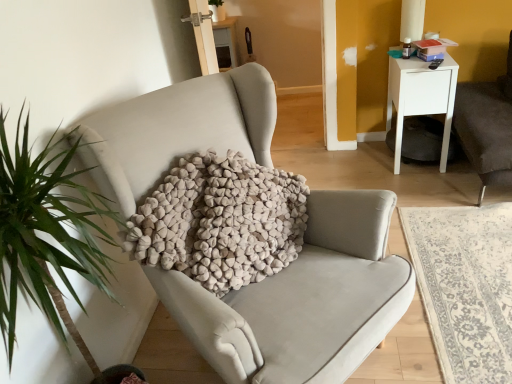
Find the location of a particular element. black plastic remote control at upper right is located at coordinates (435, 64).

Find the location of `white glossy nightstand at upper right`. white glossy nightstand at upper right is located at coordinates (421, 97).

The height and width of the screenshot is (384, 512). Describe the element at coordinates (303, 299) in the screenshot. I see `beige fabric chair at center` at that location.

This screenshot has height=384, width=512. Find the location of `black plastic remote control at upper right`. black plastic remote control at upper right is located at coordinates (435, 64).

From the image's perspective, which one is positioned higher, white glossy nightstand at upper right or beige fabric chair at center?

white glossy nightstand at upper right is shown above in the image.

Does white glossy nightstand at upper right appear on the left side of beige fabric chair at center?

In fact, white glossy nightstand at upper right is to the right of beige fabric chair at center.

Does white glossy nightstand at upper right contain beige fabric chair at center?

Definitely not — beige fabric chair at center is not inside white glossy nightstand at upper right.

From a real-world perspective, is black plastic remote control at upper right over beige fabric chair at center?

Correct, in the physical world, black plastic remote control at upper right is higher than beige fabric chair at center.

Is point (433, 64) more distant than point (116, 138)?

Yes, it is behind point (116, 138).

Is black plastic remote control at upper right surrounding beige fabric chair at center?

No, beige fabric chair at center is not a part of black plastic remote control at upper right.

Would you say black plastic remote control at upper right is a long distance from beige fabric chair at center?

That's right, there is a large distance between black plastic remote control at upper right and beige fabric chair at center.

Would you say white glossy nightstand at upper right is inside or outside black plastic remote control at upper right?

white glossy nightstand at upper right is outside black plastic remote control at upper right.

From the image's perspective, which is below, white glossy nightstand at upper right or black plastic remote control at upper right?

white glossy nightstand at upper right appears lower in the image.

Considering the relative sizes of white glossy nightstand at upper right and black plastic remote control at upper right in the image provided, is white glossy nightstand at upper right taller than black plastic remote control at upper right?

Indeed, white glossy nightstand at upper right has a greater height compared to black plastic remote control at upper right.

Between point (429, 69) and point (435, 62), which one is positioned behind?

The point (435, 62) is farther from the camera.

Is textured beige pillow at center positioned behind black plastic remote control at upper right?

No.

Find the location of a particular element. Image resolution: width=512 pixels, height=384 pixels. pillow in front of the black plastic remote control at upper right is located at coordinates click(x=221, y=221).

Consider the image. Which is less distant, (295, 246) or (439, 62)?

Clearly, point (295, 246) is closer to the camera than point (439, 62).

Is black plastic remote control at upper right in front of white glossy nightstand at upper right?

No, black plastic remote control at upper right is further to the viewer.

Which of these two, black plastic remote control at upper right or white glossy nightstand at upper right, is smaller?

With smaller size is black plastic remote control at upper right.

Can you confirm if black plastic remote control at upper right is taller than white glossy nightstand at upper right?

Incorrect, the height of black plastic remote control at upper right is not larger of that of white glossy nightstand at upper right.

Is textured beige pillow at center taller or shorter than beige fabric chair at center?

Clearly, textured beige pillow at center is taller compared to beige fabric chair at center.

Would you say textured beige pillow at center is a long distance from beige fabric chair at center?

No.

From the image's perspective, would you say textured beige pillow at center is shown under white glossy nightstand at upper right?

Yes, from the image's perspective, textured beige pillow at center is beneath white glossy nightstand at upper right.

Who is taller, textured beige pillow at center or white glossy nightstand at upper right?

white glossy nightstand at upper right is taller.

Is textured beige pillow at center next to white glossy nightstand at upper right and touching it?

No, textured beige pillow at center is not in contact with white glossy nightstand at upper right.

Does textured beige pillow at center have a greater width compared to white glossy nightstand at upper right?

In fact, textured beige pillow at center might be narrower than white glossy nightstand at upper right.

The image size is (512, 384). I want to click on nightstand on the right of beige fabric chair at center, so click(x=421, y=97).

Identify the location of remote control behind the beige fabric chair at center. The image size is (512, 384). (435, 64).

From the image, which object appears to be nearer to white glossy nightstand at upper right, beige fabric chair at center or textured beige pillow at center?

Among the two, textured beige pillow at center is located nearer to white glossy nightstand at upper right.

Considering their positions, is black plastic remote control at upper right positioned further to textured beige pillow at center than beige fabric chair at center?

The object further to textured beige pillow at center is black plastic remote control at upper right.

Based on the photo, which object lies nearer to the anchor point white glossy nightstand at upper right, beige fabric chair at center or black plastic remote control at upper right?

black plastic remote control at upper right is closer to white glossy nightstand at upper right.

When comparing their distances from textured beige pillow at center, does beige fabric chair at center or black plastic remote control at upper right seem further?

Among the two, black plastic remote control at upper right is located further to textured beige pillow at center.

Which object lies nearer to the anchor point beige fabric chair at center, white glossy nightstand at upper right or textured beige pillow at center?

The object closer to beige fabric chair at center is textured beige pillow at center.

Which object lies nearer to the anchor point textured beige pillow at center, white glossy nightstand at upper right or black plastic remote control at upper right?

white glossy nightstand at upper right is positioned closer to the anchor textured beige pillow at center.

Considering their positions, is black plastic remote control at upper right positioned further to white glossy nightstand at upper right than beige fabric chair at center?

beige fabric chair at center.

Based on their spatial positions, is textured beige pillow at center or white glossy nightstand at upper right closer to beige fabric chair at center?

textured beige pillow at center is closer to beige fabric chair at center.

Where is `nightstand located between beige fabric chair at center and black plastic remote control at upper right in the depth direction`? The image size is (512, 384). nightstand located between beige fabric chair at center and black plastic remote control at upper right in the depth direction is located at coordinates (421, 97).

This screenshot has height=384, width=512. What are the coordinates of `nightstand located between textured beige pillow at center and black plastic remote control at upper right in the depth direction` in the screenshot? It's located at (421, 97).

The image size is (512, 384). In order to click on chair between textured beige pillow at center and black plastic remote control at upper right along the z-axis in this screenshot , I will do `click(303, 299)`.

This screenshot has height=384, width=512. Find the location of `chair between textured beige pillow at center and white glossy nightstand at upper right along the z-axis`. chair between textured beige pillow at center and white glossy nightstand at upper right along the z-axis is located at coordinates click(x=303, y=299).